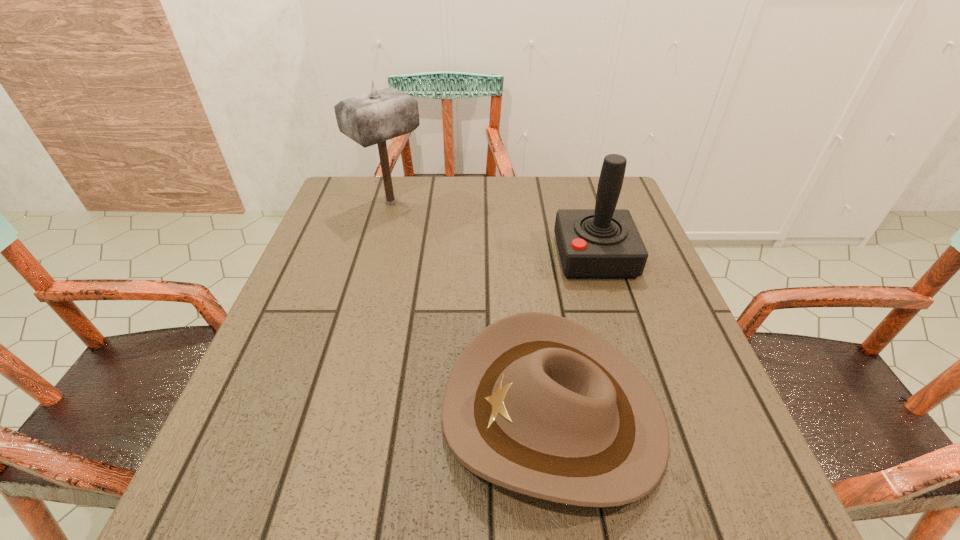
Find the location of a particular element. This screenshot has height=540, width=960. object that is the second closest one to the joystick is located at coordinates (373, 118).

Select which object is the second closest to the tallest object. Please provide its 2D coordinates. Your answer should be formatted as a tuple, i.e. [(x, y)], where the tuple contains the x and y coordinates of a point satisfying the conditions above.

[(538, 404)]